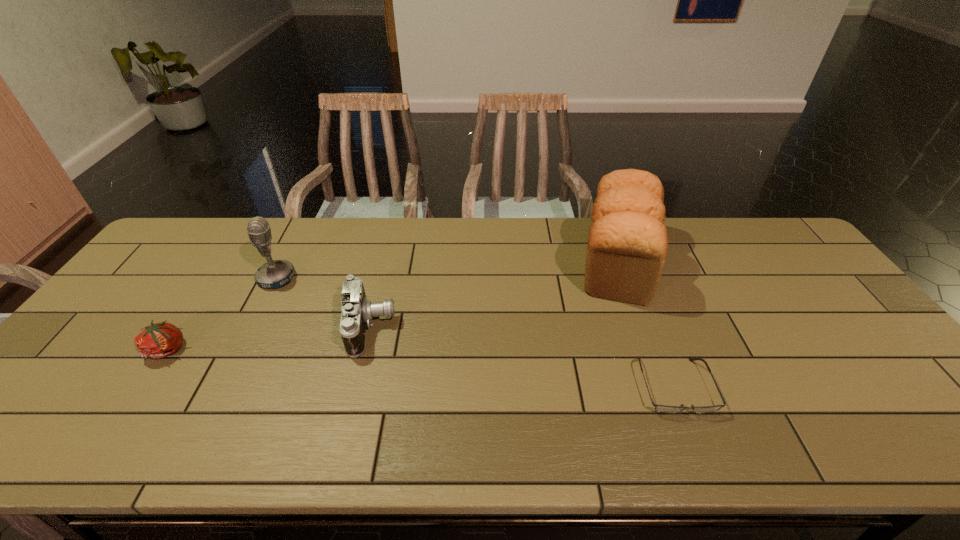
In order to click on vacant space located at the lens of the third tallest object in this screenshot , I will do `click(478, 328)`.

Where is `blank space located on the front of the fourth tallest object`? The width and height of the screenshot is (960, 540). blank space located on the front of the fourth tallest object is located at coordinates pyautogui.click(x=144, y=386).

The height and width of the screenshot is (540, 960). What are the coordinates of `object present at the far edge` in the screenshot? It's located at (627, 243).

At what (x,y) coordinates should I click in order to perform the action: click on blank space at the far edge of the desktop. Please return your answer as a coordinate pair (x, y). This screenshot has width=960, height=540. Looking at the image, I should click on (289, 227).

Find the location of a particular element. vacant space at the near edge of the desktop is located at coordinates [444, 418].

You are a GUI agent. You are given a task and a screenshot of the screen. Output one action in this format:
    pyautogui.click(x=<x>, y=<y>)
    Task: Click on the free space at the left edge
    The image size is (960, 540).
    Given the screenshot: What is the action you would take?
    pyautogui.click(x=189, y=269)

This screenshot has width=960, height=540. I want to click on blank area at the right edge, so click(830, 287).

Identify the location of vacant area at the far left corner. The width and height of the screenshot is (960, 540). (226, 227).

Locate an element on the screen. Image resolution: width=960 pixels, height=540 pixels. free space at the near left corner of the desktop is located at coordinates (88, 421).

Locate an element on the screen. free region at the far right corner of the desktop is located at coordinates (736, 232).